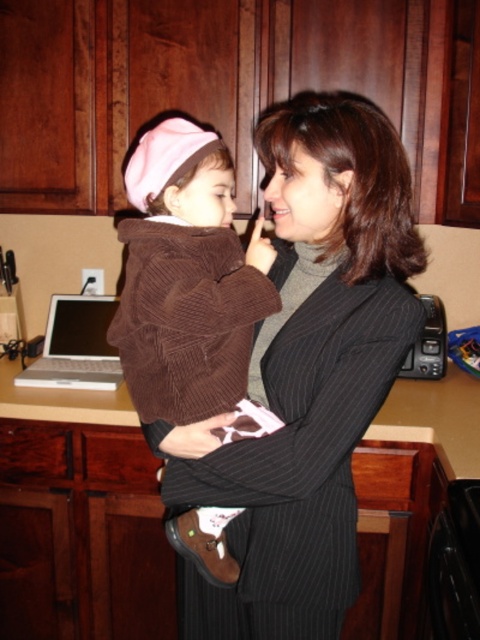
You are standing in the kitchen and want to reach the point at coordinates (327, 568). If your arm can extend 1 meter, can you reach that point without moving?

The point at coordinates (327, 568) is 1.11 meters away from you, so your arm cannot reach it since it can only extend 1 meter. You need to move closer.